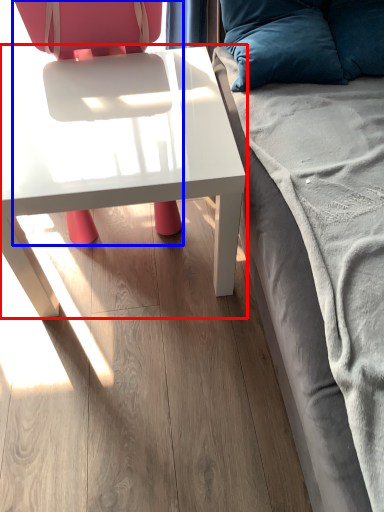
Question: Among these objects, which one is nearest to the camera, table (highlighted by a red box) or chair (highlighted by a blue box)?

Choices:
 (A) table
 (B) chair

Answer: (B)